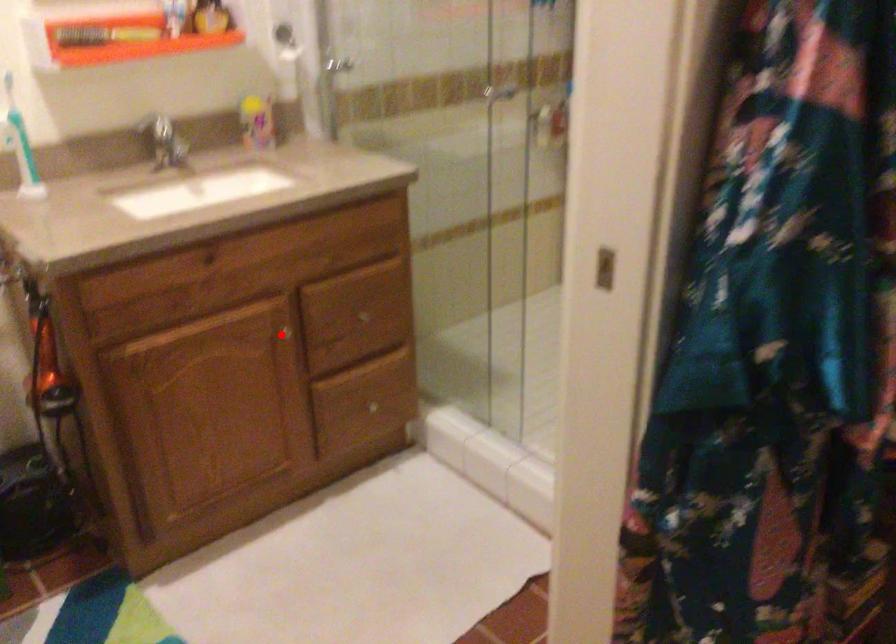
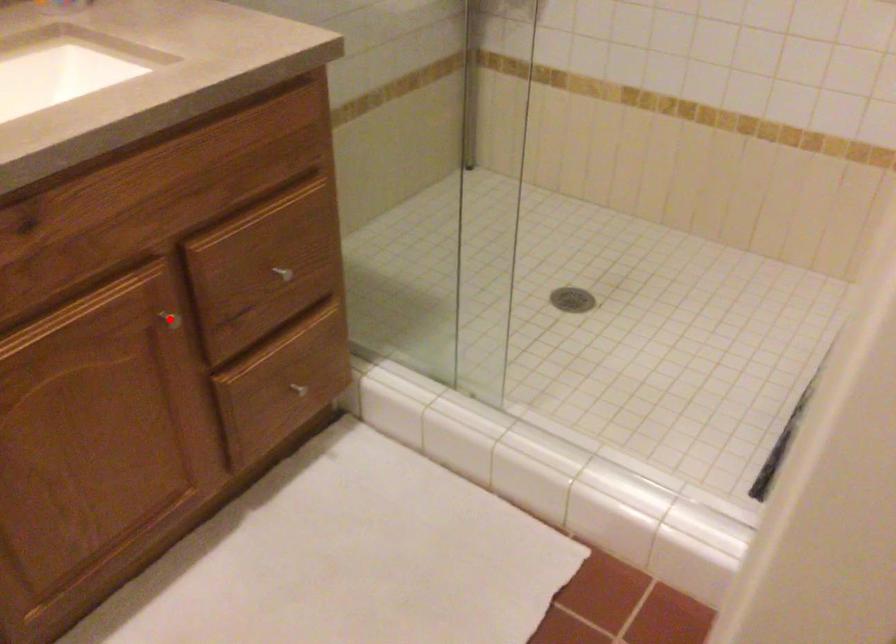
I am providing you with two images of the same scene from different viewpoints. A red point is marked on the first image and another point is marked on the second image. Is the marked point in image1 the same physical position as the marked point in image2?

Yes